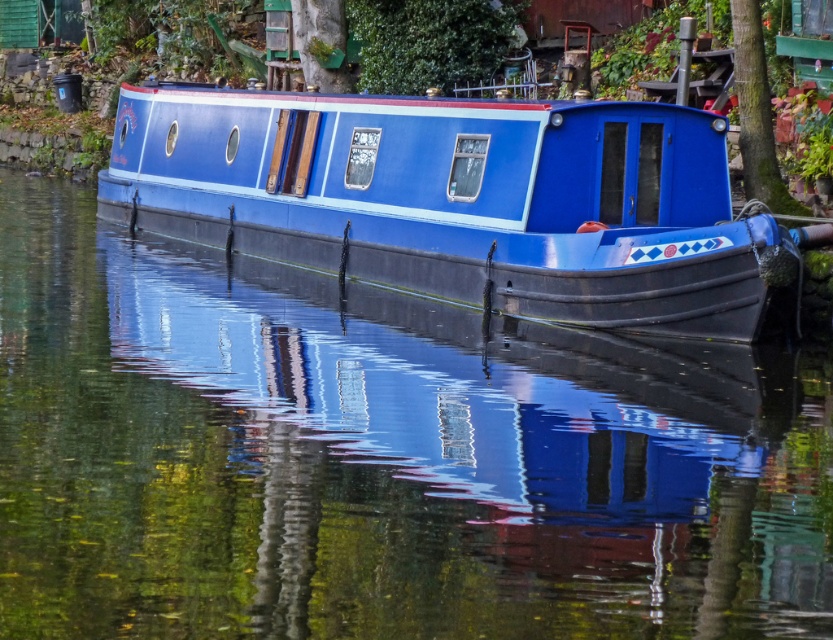
You are standing on the dock and want to take a photo of the blue glossy boat at center. If your camera has a maximum zoom range of 10 meters, will you be able to capture the boat clearly without moving closer?

The distance between the blue glossy boat at center and the camera is 15.86 meters. Since the camera can only zoom up to 10 meters, you will not be able to capture the boat clearly without moving closer.

You are a painter standing on the dock and want to paint the scene. You notice the transparent glass water at center and the green rough bark tree at upper right. Which object should you look down to paint?

Answer: You should look down to paint the transparent glass water at center because it is located at the center of the image, which is lower than the green rough bark tree at upper right.

You are an artist planning to paint the scene. You want to ensure the transparent glass water at center and the green rough bark tree at upper right are proportionally accurate. Which object should you paint first to maintain the correct size relationship between them?

You should paint the transparent glass water at center first since it is larger in size than the green rough bark tree at upper right, ensuring the proportions are accurate from the start.